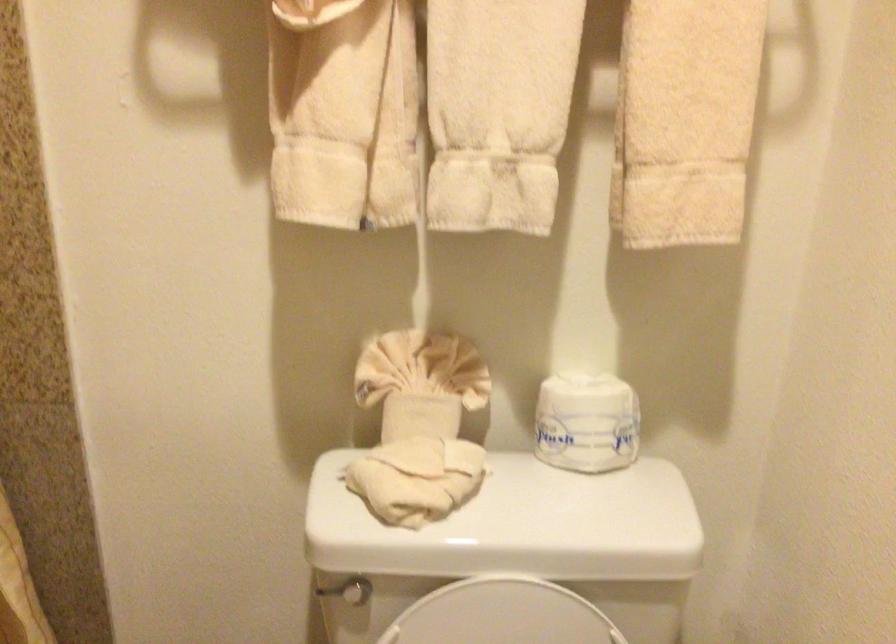
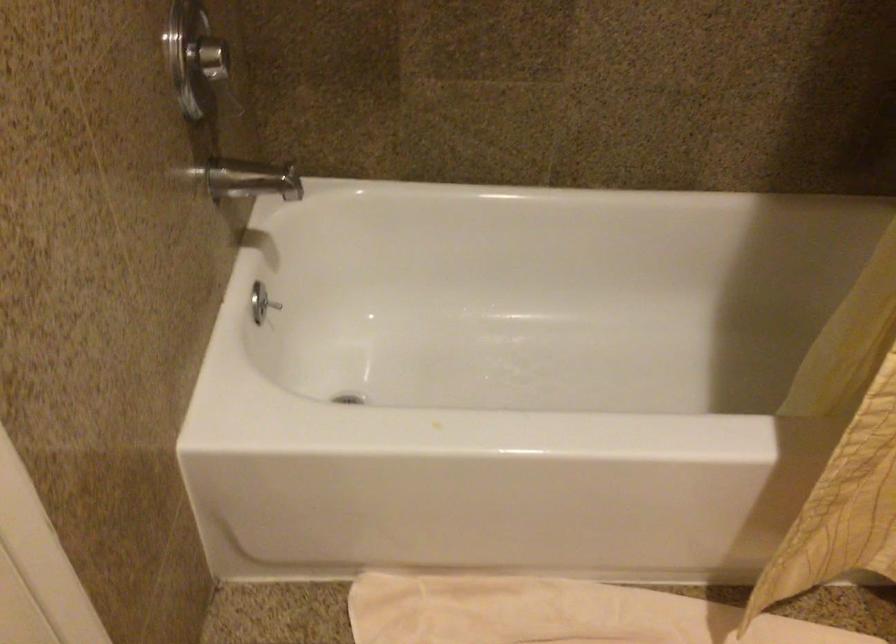
The first image is from the beginning of the video and the second image is from the end. How did the camera likely rotate when shooting the video?

The camera rotated toward left-down.